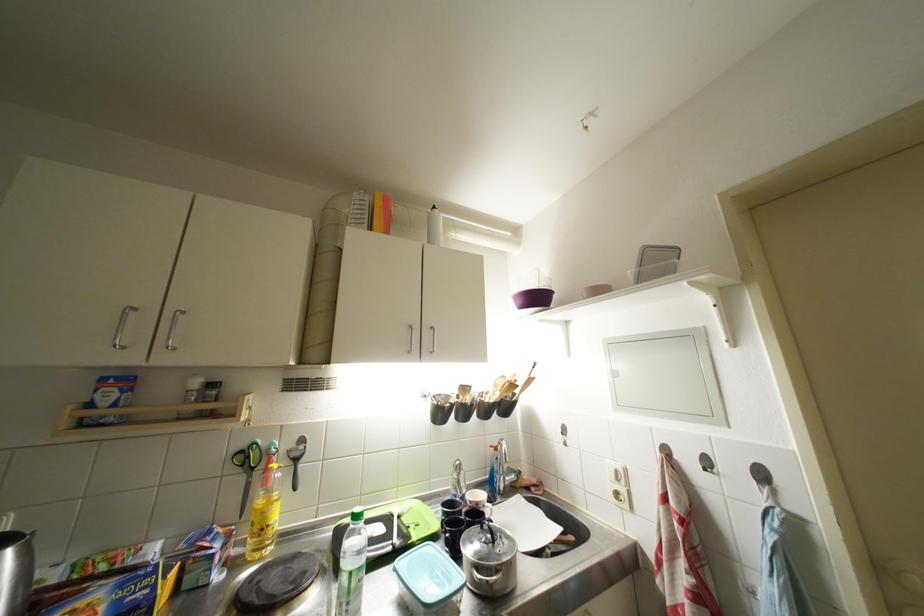
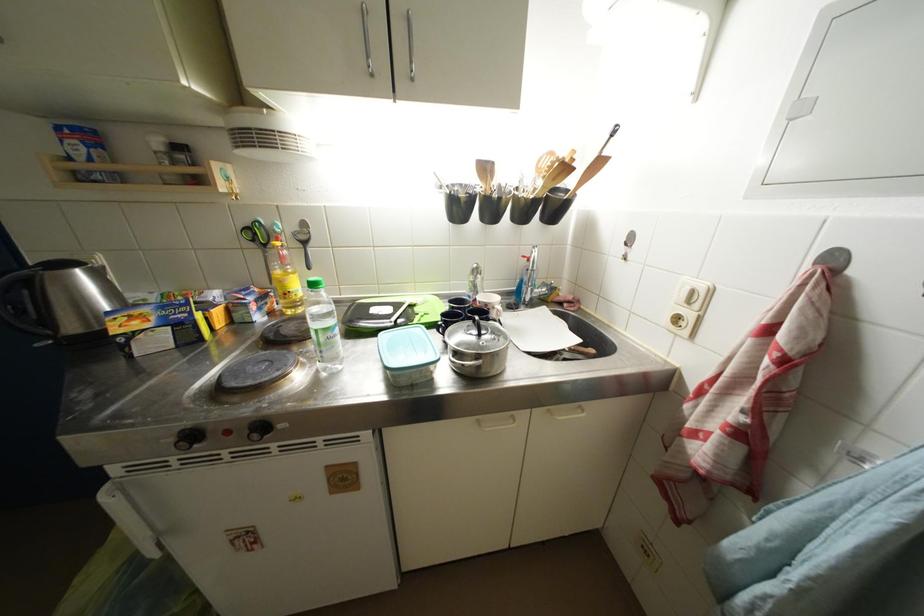
In the second image, find the point that corresponds to [249,450] in the first image.

(253, 227)